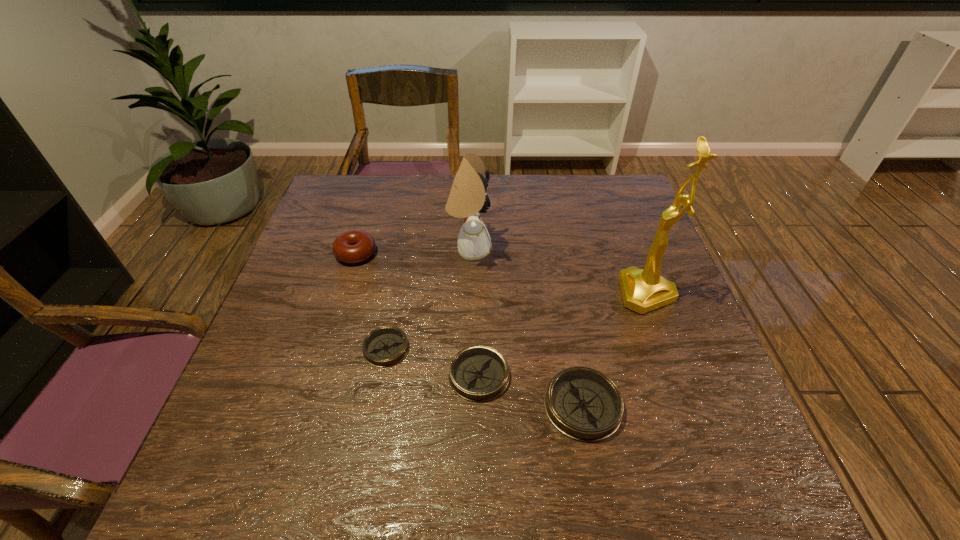
Considering the uniform spacing of compasss, where should an additional compass be positioned on the right? Please locate a free spot. Please provide its 2D coordinates. Your answer should be formatted as a tuple, i.e. [(x, y)], where the tuple contains the x and y coordinates of a point satisfying the conditions above.

[(699, 439)]